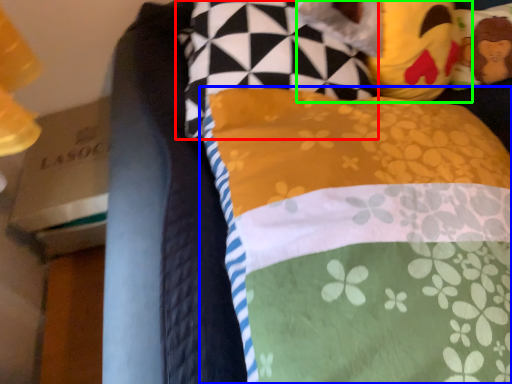
Question: Considering the real-world distances, which object is farthest from pillow (highlighted by a red box)? pillow (highlighted by a blue box) or figurine (highlighted by a green box)?

Choices:
 (A) pillow
 (B) figurine

Answer: (A)